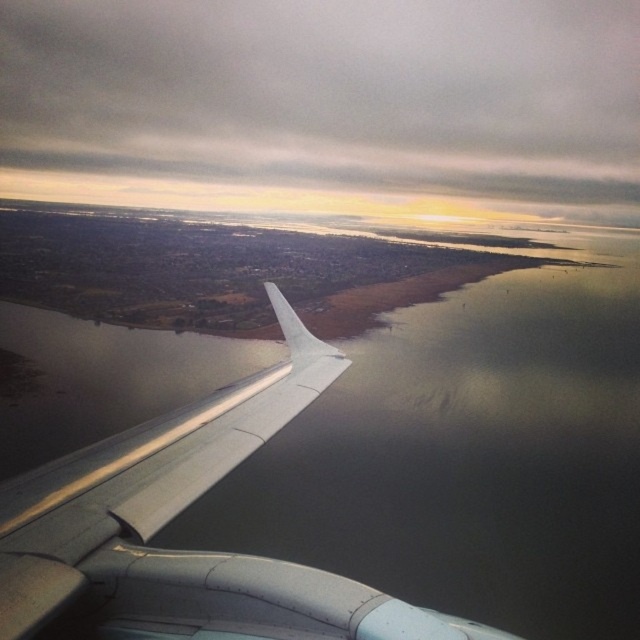
You are a passenger on the airplane and looking out the window. You see the gray matte cloud at upper center and the metallic gray wing at lower left. Which object is higher in the sky?

The gray matte cloud at upper center is higher in the sky than the metallic gray wing at lower left because it is positioned above it.

You are a pilot flying the plane and need to check if there is enough vertical space between the metallic gray wing at lower left and the gray matte cloud at upper center to avoid collision. Based on the scene, can you determine if the vertical distance is sufficient?

The gray matte cloud at upper center has a greater height compared to the metallic gray wing at lower left, meaning there is enough vertical space between them to avoid collision.

You are a pilot looking at the view from the airplane window. You notice a gray matte cloud at upper center. What are the coordinates of this cloud?

The gray matte cloud at upper center is located at coordinates point (x=324, y=106).